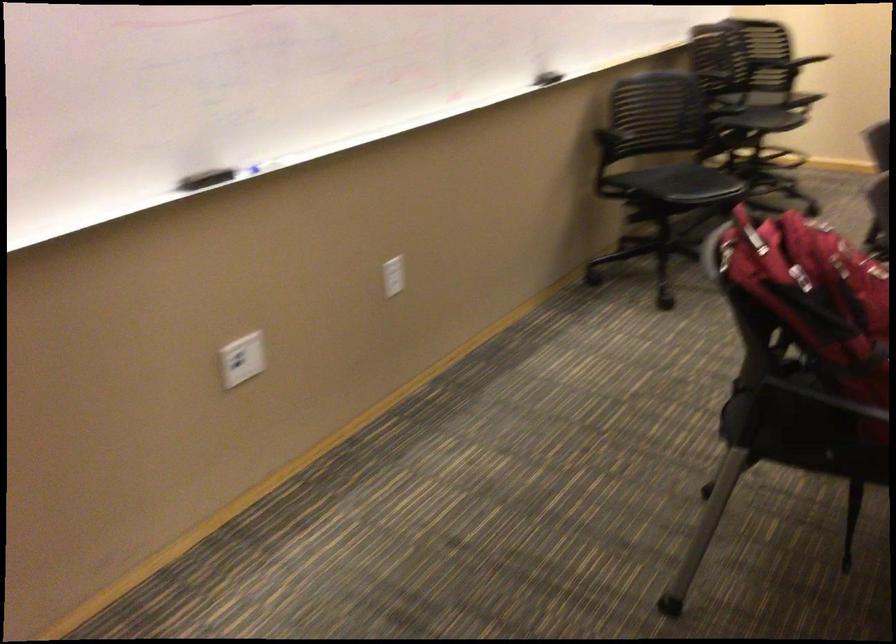
The location [392,276] corresponds to which object?

It refers to a white light switch.